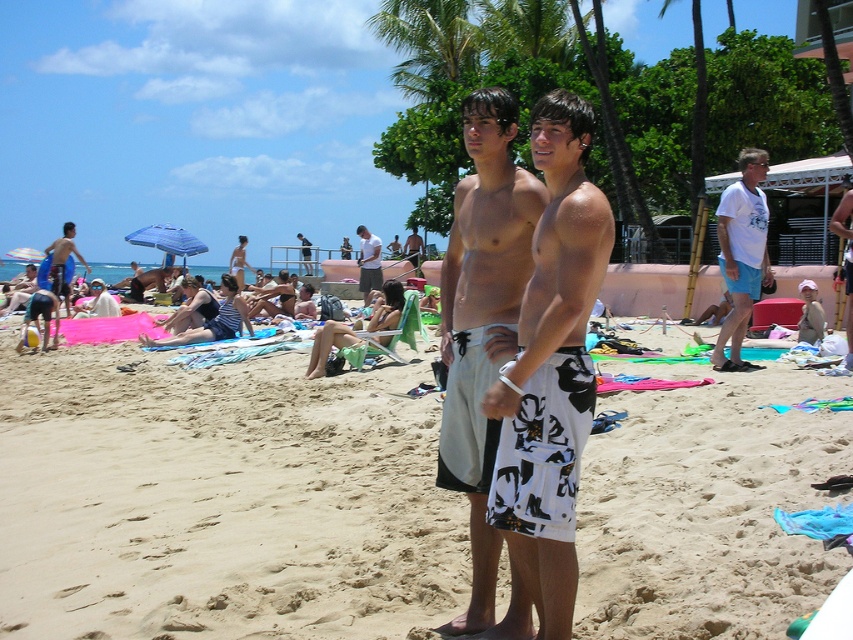
Question: Can you confirm if white cotton t-shirt at right is positioned above matte black surfboard at left?

Choices:
 (A) no
 (B) yes

Answer: (A)

Question: Which point is farther from the camera taking this photo?

Choices:
 (A) (376, 371)
 (B) (73, 234)
 (C) (752, 161)

Answer: (B)

Question: Does white printed boardshorts at center have a larger size compared to white textured boardshorts at center?

Choices:
 (A) no
 (B) yes

Answer: (B)

Question: Which of the following is the closest to the observer?

Choices:
 (A) (59, 244)
 (B) (737, 440)
 (C) (413, 252)
 (D) (541, 196)

Answer: (D)

Question: Among these points, which one is nearest to the camera?

Choices:
 (A) (492, 104)
 (B) (519, 560)

Answer: (B)

Question: Is matte black surfboard at left positioned in front of smooth tan skin at center?

Choices:
 (A) yes
 (B) no

Answer: (A)